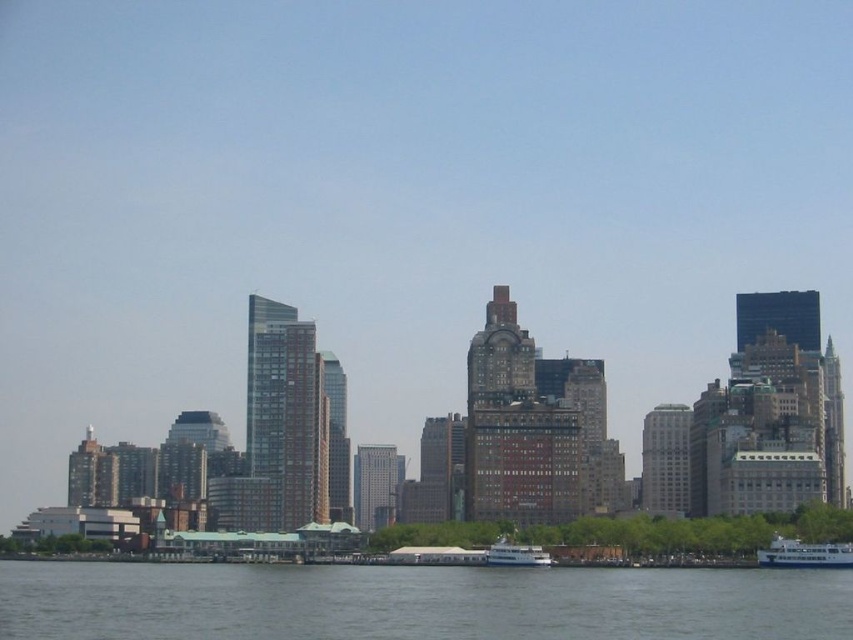
Is gray water at lower center below white glossy boat at lower right?

Indeed, gray water at lower center is positioned under white glossy boat at lower right.

Who is taller, gray water at lower center or white glossy boat at lower right?

With more height is white glossy boat at lower right.

Image resolution: width=853 pixels, height=640 pixels. What are the coordinates of `gray water at lower center` in the screenshot? It's located at (416, 602).

Locate an element on the screen. gray water at lower center is located at coordinates (416, 602).

Does gray water at lower center appear on the right side of white glossy boat at lower center?

No, gray water at lower center is not to the right of white glossy boat at lower center.

Describe the element at coordinates (416, 602) in the screenshot. This screenshot has width=853, height=640. I see `gray water at lower center` at that location.

Is point (548, 604) behind point (496, 561)?

No, (548, 604) is in front of (496, 561).

In order to click on gray water at lower center in this screenshot , I will do `click(416, 602)`.

Which is more to the right, white glossy boat at lower right or white glossy boat at lower center?

From the viewer's perspective, white glossy boat at lower right appears more on the right side.

Can you confirm if white glossy boat at lower right is taller than white glossy boat at lower center?

Yes, white glossy boat at lower right is taller than white glossy boat at lower center.

Is point (811, 548) closer to viewer compared to point (527, 556)?

No, (811, 548) is further to viewer.

Find the location of a particular element. This screenshot has height=640, width=853. white glossy boat at lower right is located at coordinates (804, 554).